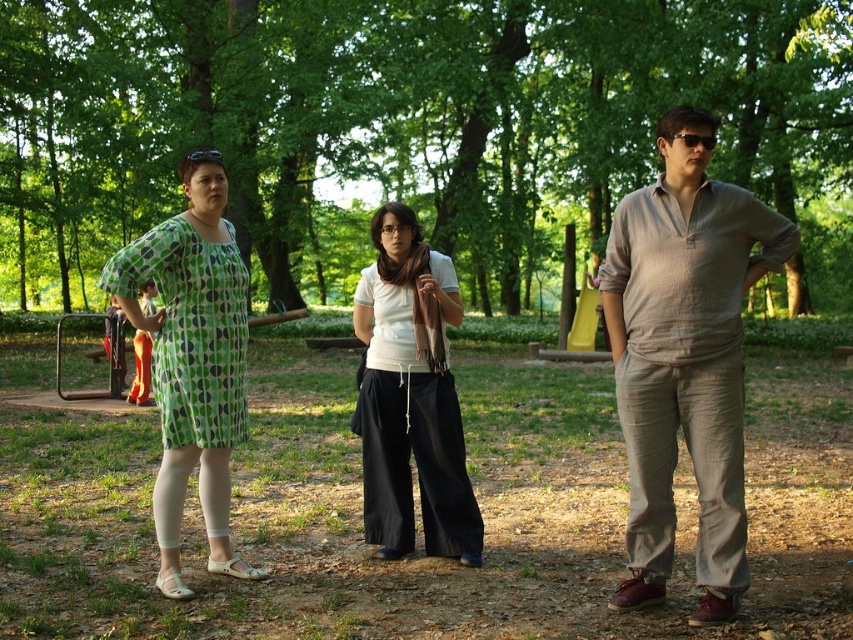
Based on the photo, you are standing in the park and see the green leafy tree at center and the white cotton shirt at center. Which object is positioned to the left?

The green leafy tree at center is to the left of the white cotton shirt at center, so the green leafy tree at center is positioned to the left.

You are standing in the park and see three people. The person on the left is wearing a green dress with darker green circles and white leggings. The middle person is at point (418, 513). Where is the person wearing the matte green dress?

The person wearing the matte green dress is at point (418, 513).